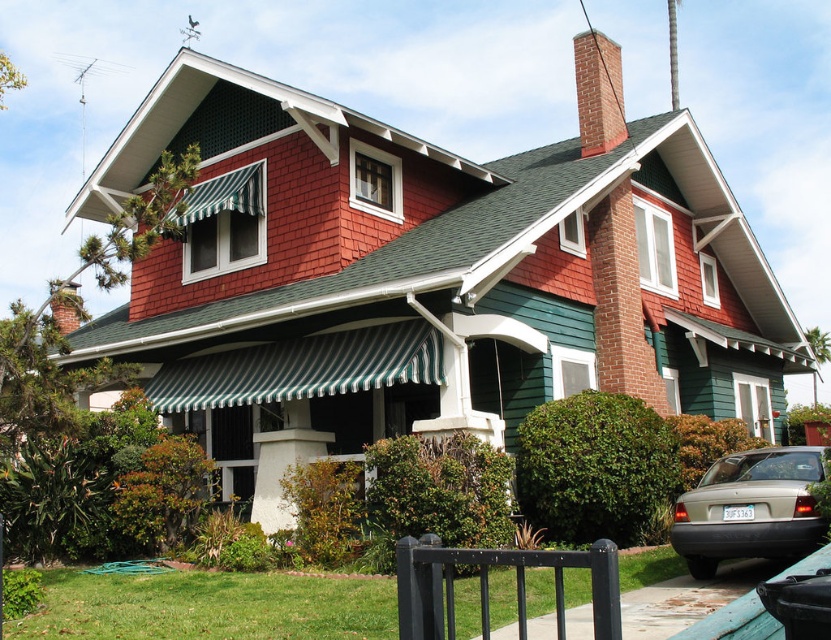
You are standing in front of the house and see two points marked on the image. One is at point (709, 516) and the other at point (591, 60). From your perspective, which point appears closer to you?

Point (709, 516) is in front of point (591, 60), so it appears closer to you.